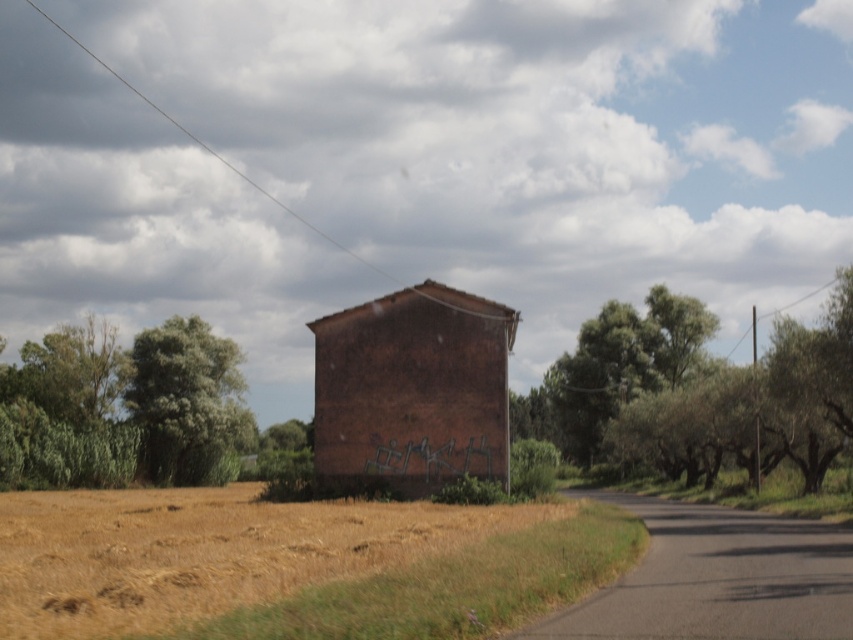
You are a hiker standing at the edge of the field looking towards the road. You notice two green leafy trees in the scene. Which tree is closer to the road, the green leafy tree at upper right or the green leafy tree at left?

The green leafy tree at upper right is positioned over the green leafy tree at left, meaning it is closer to the viewer. Since the road is in the foreground, the tree closer to the viewer would be nearer to the road. Therefore, the green leafy tree at upper right is closer to the road.

In the scene shown: You are a gardener planning to plant a new tree in the field near the weathered brick structure. You want to ensure that the new tree will not block the view of the paved road flanked by trees and shrubs. Considering the existing green leafy tree at right and the green leafy tree at upper right, which tree has a wider canopy that might obstruct the view more?

The green leafy tree at right has a wider canopy than the green leafy tree at upper right, so it might obstruct the view more.

You are a hiker standing at the edge of the field looking towards the road. You see two green leafy trees in the distance. One is labeled as the green leafy tree at right and the other as the green leafy tree at upper right. Which tree is closer to you?

The green leafy tree at right is positioned over the green leafy tree at upper right, meaning it is closer to you.